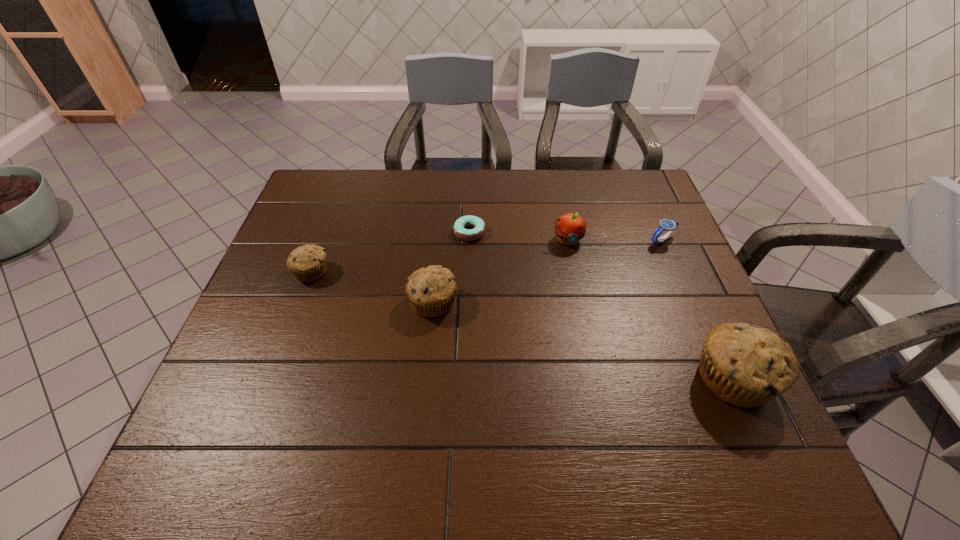
Identify the location of free space between the watch and the rightmost muffin. The image size is (960, 540). (698, 309).

Identify the location of free spot between the leftmost object and the fifth tallest object. (487, 256).

Image resolution: width=960 pixels, height=540 pixels. In order to click on unoccupied position between the nearest object and the fourth object from left to right in this screenshot , I will do `click(651, 309)`.

Identify the location of unoccupied area between the apple and the second muffin from right to left. Image resolution: width=960 pixels, height=540 pixels. (500, 271).

At what (x,y) coordinates should I click in order to perform the action: click on the fourth closest object relative to the shortest object. Please return your answer as a coordinate pair (x, y). Looking at the image, I should click on (671, 226).

Identify which object is located as the fourth nearest to the nearest muffin. Please provide its 2D coordinates. Your answer should be formatted as a tuple, i.e. [(x, y)], where the tuple contains the x and y coordinates of a point satisfying the conditions above.

[(459, 226)]

Select which muffin is the second closest to the second shortest muffin. Please provide its 2D coordinates. Your answer should be formatted as a tuple, i.e. [(x, y)], where the tuple contains the x and y coordinates of a point satisfying the conditions above.

[(745, 365)]

Find the location of `the closest muffin relative to the second muffin from left to right`. the closest muffin relative to the second muffin from left to right is located at coordinates (308, 263).

This screenshot has width=960, height=540. In order to click on vacant space that satisfies the following two spatial constraints: 1. on the back side of the second shortest muffin; 2. on the right side of the shortest object in this screenshot , I will do `click(440, 232)`.

At what (x,y) coordinates should I click in order to perform the action: click on vacant position in the image that satisfies the following two spatial constraints: 1. on the back side of the doughnut; 2. on the right side of the second muffin from left to right. Please return your answer as a coordinate pair (x, y). This screenshot has width=960, height=540. Looking at the image, I should click on (440, 232).